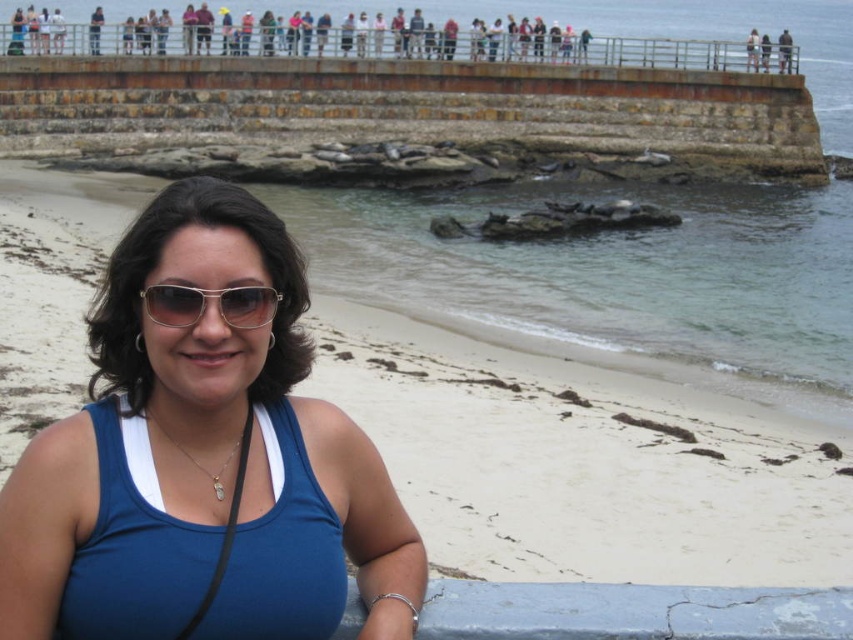
You are a photographer trying to capture the woman in the scene. You notice the matte blue tank top at center and the gold metallic sunglasses at center. Which object should you focus on first if you want to capture the one closer to the left side?

The matte blue tank top at center is to the left of the gold metallic sunglasses at center, so you should focus on the matte blue tank top at center first as it is positioned closer to the left side.

The woman is standing on the beach. There is a point at coordinates (202, 461). What is located at that point?

The point at coordinates (202, 461) is where the matte blue tank top at center is located.